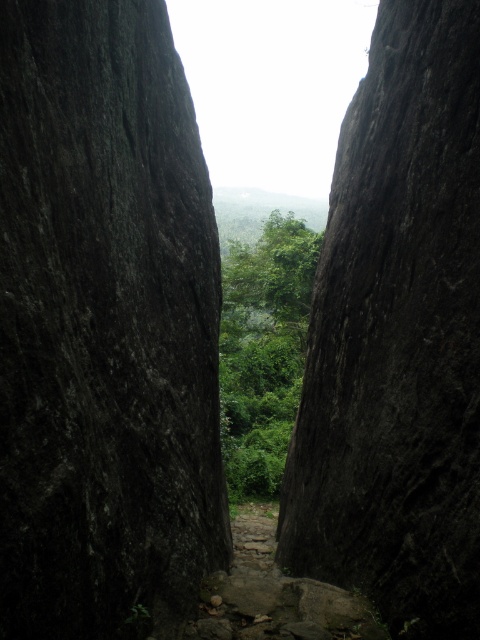
Does point (137, 77) lie in front of point (248, 412)?

Yes, point (137, 77) is in front of point (248, 412).

Between point (153, 52) and point (291, 378), which one is positioned in front?

Point (153, 52) is in front.

Identify the location of dark gray rough rock face at center. (105, 326).